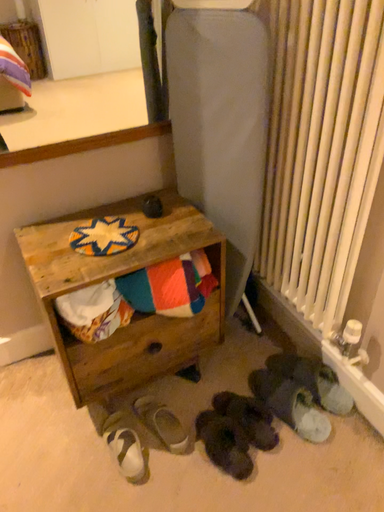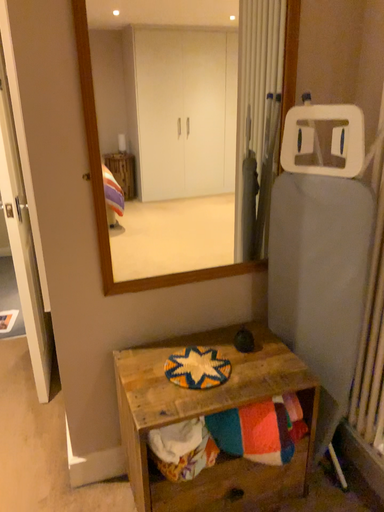
Question: How did the camera likely rotate when shooting the video?

Choices:
 (A) rotated right
 (B) rotated left

Answer: (B)